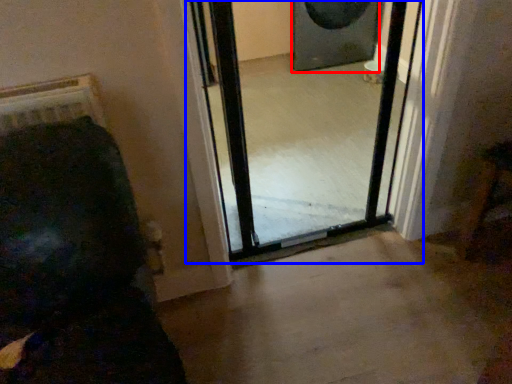
Question: Among these objects, which one is nearest to the camera, speaker (highlighted by a red box) or screen door (highlighted by a blue box)?

Choices:
 (A) speaker
 (B) screen door

Answer: (B)